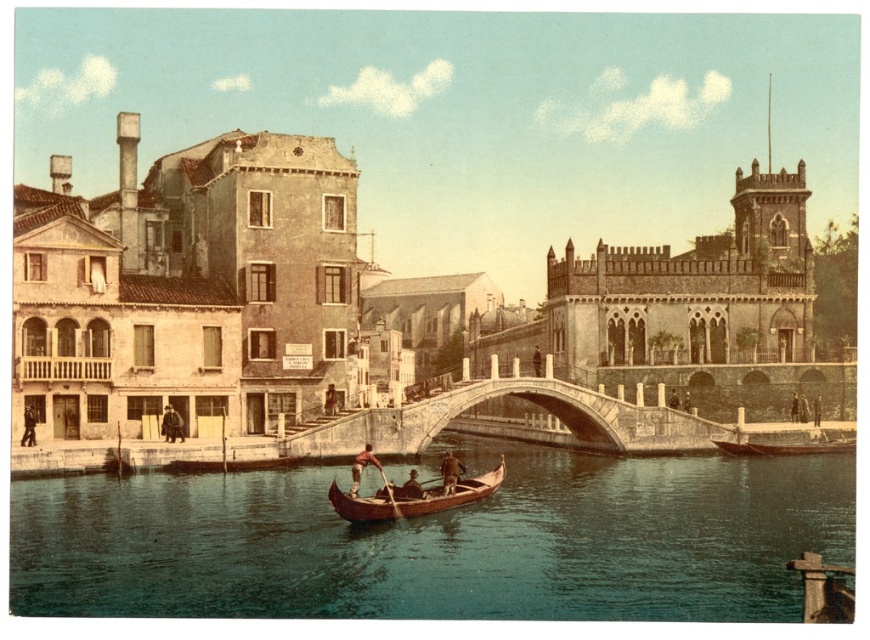
Question: Estimate the real-world distances between objects in this image. Which object is closer to the brown leather hat at center?

Choices:
 (A) brown leather boat at center
 (B) teal smooth water at center
 (C) wooden canoe at center

Answer: (C)

Question: From the image, what is the correct spatial relationship of wooden canoe at center in relation to brown leather boat at center?

Choices:
 (A) above
 (B) below

Answer: (A)

Question: Where is teal smooth water at center located in relation to brown leather boat at center in the image?

Choices:
 (A) right
 (B) left

Answer: (A)

Question: Is smooth brown leather oar at center bigger than brown leather hat at center?

Choices:
 (A) yes
 (B) no

Answer: (A)

Question: Based on their relative distances, which object is farther from the smooth brown leather oar at center?

Choices:
 (A) wooden canoe at center
 (B) brown leather boat at center
 (C) teal smooth water at center

Answer: (C)

Question: Which point is farther from the camera taking this photo?

Choices:
 (A) (449, 484)
 (B) (402, 490)

Answer: (A)